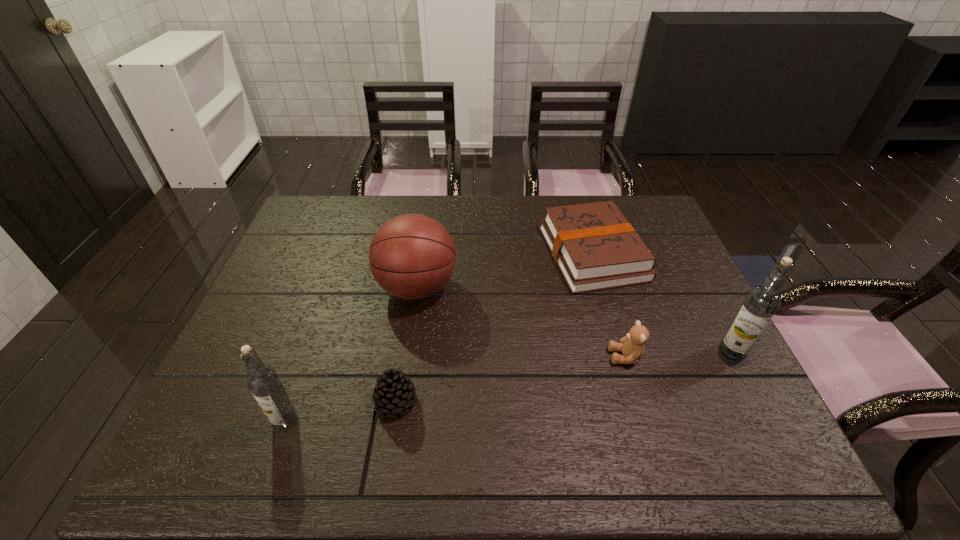
At what (x,y) coordinates should I click in order to perform the action: click on free location located on the label of the taller vodka. Please return your answer as a coordinate pair (x, y). Looking at the image, I should click on (678, 352).

Locate an element on the screen. free space located 0.160m on the label of the taller vodka is located at coordinates (654, 352).

The height and width of the screenshot is (540, 960). Find the location of `vacant space located 0.330m on the label of the taller vodka`. vacant space located 0.330m on the label of the taller vodka is located at coordinates (584, 352).

Image resolution: width=960 pixels, height=540 pixels. In order to click on vacant space located 0.220m on the front of the basketball in this screenshot , I will do `click(402, 391)`.

Find the location of a particular element. The height and width of the screenshot is (540, 960). vacant space located 0.350m on the left of the shortest object is located at coordinates (429, 253).

This screenshot has height=540, width=960. Find the location of `vacant space located 0.110m on the face of the teddy bear`. vacant space located 0.110m on the face of the teddy bear is located at coordinates (564, 356).

You are a GUI agent. You are given a task and a screenshot of the screen. Output one action in this format:
    pyautogui.click(x=<x>, y=<y>)
    Task: Click on the vacant space situated 0.140m on the face of the teddy bear
    This screenshot has width=960, height=540.
    Given the screenshot: What is the action you would take?
    pyautogui.click(x=552, y=356)

Identify the location of vacant region located on the face of the teddy bear. The width and height of the screenshot is (960, 540). (511, 356).

You are a GUI agent. You are given a task and a screenshot of the screen. Output one action in this format:
    pyautogui.click(x=<x>, y=<y>)
    Task: Click on the object at the far edge
    
    Given the screenshot: What is the action you would take?
    pyautogui.click(x=595, y=247)

This screenshot has height=540, width=960. Find the location of `vodka that is positioned at the near edge`. vodka that is positioned at the near edge is located at coordinates (263, 381).